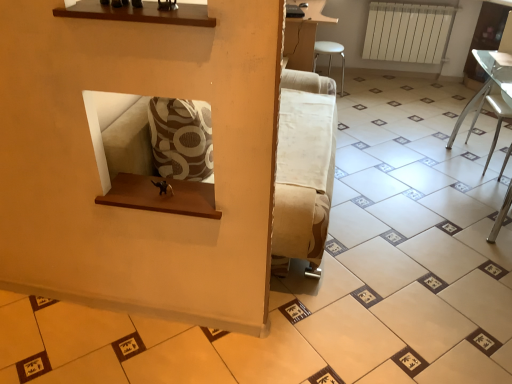
This screenshot has height=384, width=512. Identify the location of spots to the right of white plastic stool at upper right, which appears as the 1th furniture when viewed from the left. (358, 95).